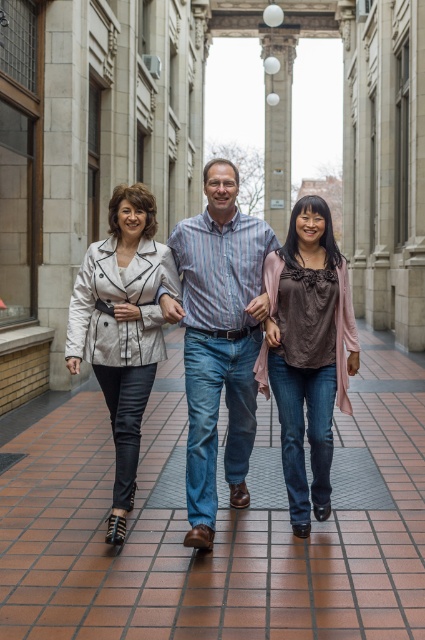
You are a fashion designer observing the three people in the scene. You need to determine which clothing item, the brown matte top at center or the matte white blazer at center, would require more fabric to make. Based on their sizes in the image, which one would need more material?

The matte white blazer at center has a greater width than the brown matte top at center, so it would require more fabric to make.